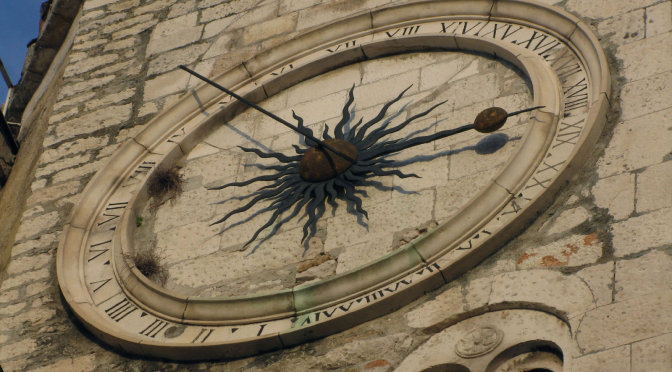
Where is `wall to left of clock`? The width and height of the screenshot is (672, 372). wall to left of clock is located at coordinates (44, 227).